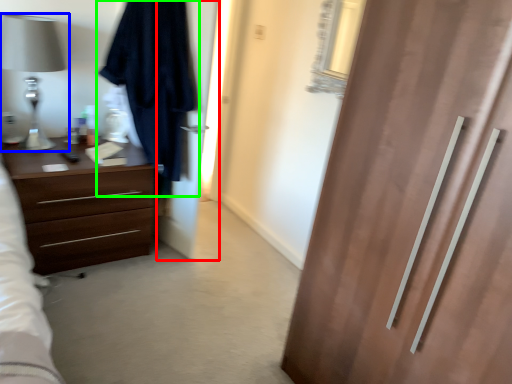
Question: Which is nearer to the screen door (highlighted by a red box)? table lamp (highlighted by a blue box) or robe (highlighted by a green box).

Choices:
 (A) table lamp
 (B) robe

Answer: (B)